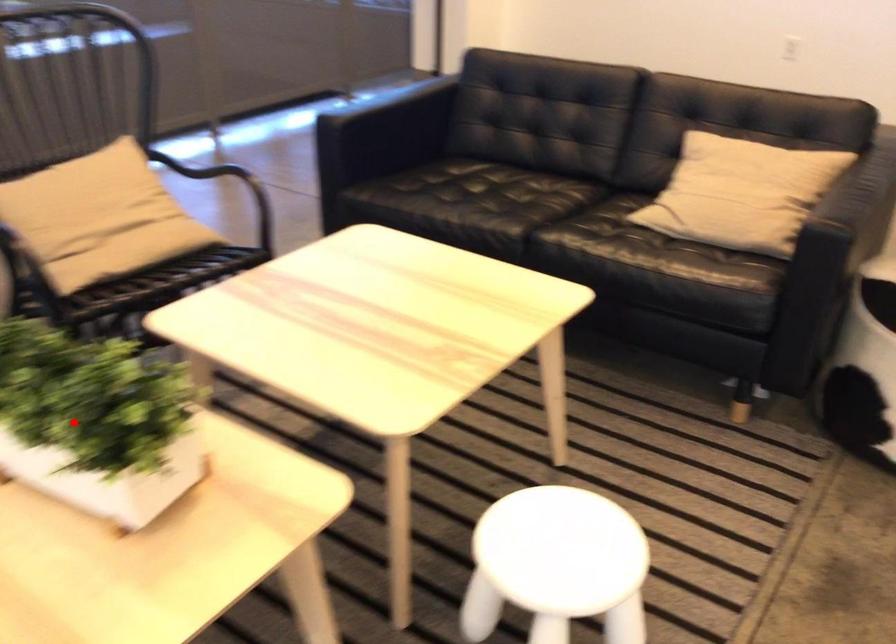
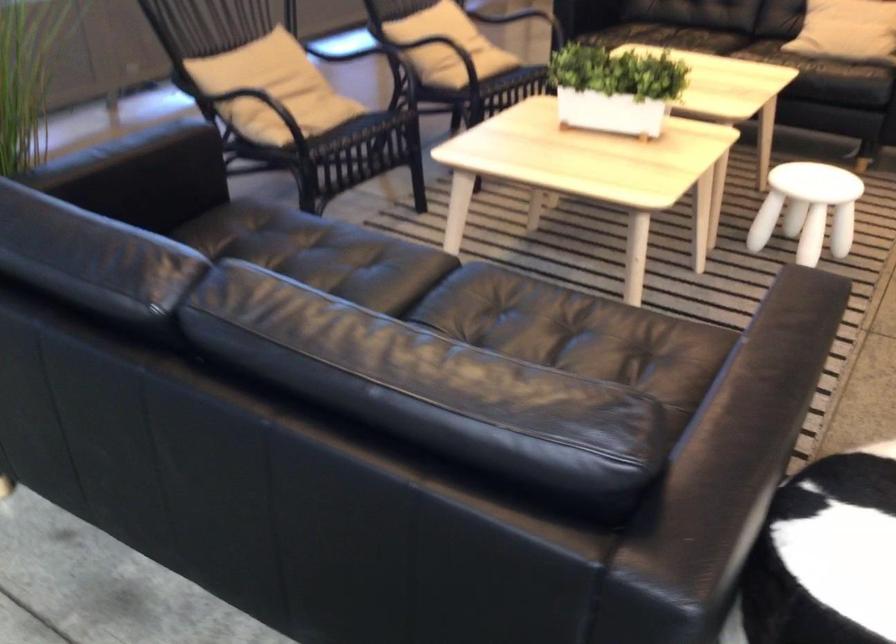
Find the pixel in the second image that matches the highlighted location in the first image.

(615, 88)